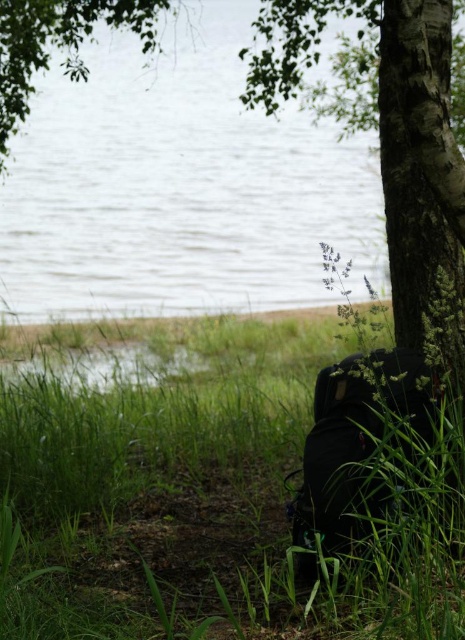
You are a photographer trying to capture the green matte grass at lower right and the clear water at center in your shot. Which of these two elements will appear smaller in your final photograph?

The green matte grass at lower right will appear smaller in the photograph because it is smaller than the clear water at center according to the description.

You are a photographer trying to capture the green matte grass at lower right and the clear water at center in a single shot. Based on the scene, which object will appear larger in your photo?

The green matte grass at lower right will appear larger in the photo because it is closer to the viewer than the clear water at center.